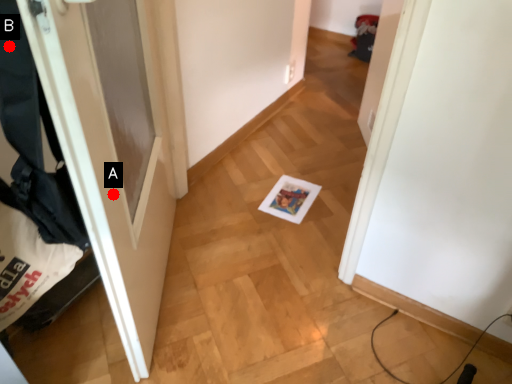
Question: Two points are circled on the image, labeled by A and B beside each circle. Among these points, which one is nearest to the camera?

Choices:
 (A) A is closer
 (B) B is closer

Answer: (B)